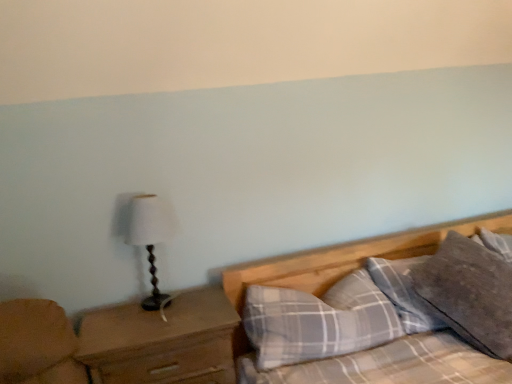
Where is `vacant space to the right of wooden table lamp at left`? The image size is (512, 384). vacant space to the right of wooden table lamp at left is located at coordinates (202, 304).